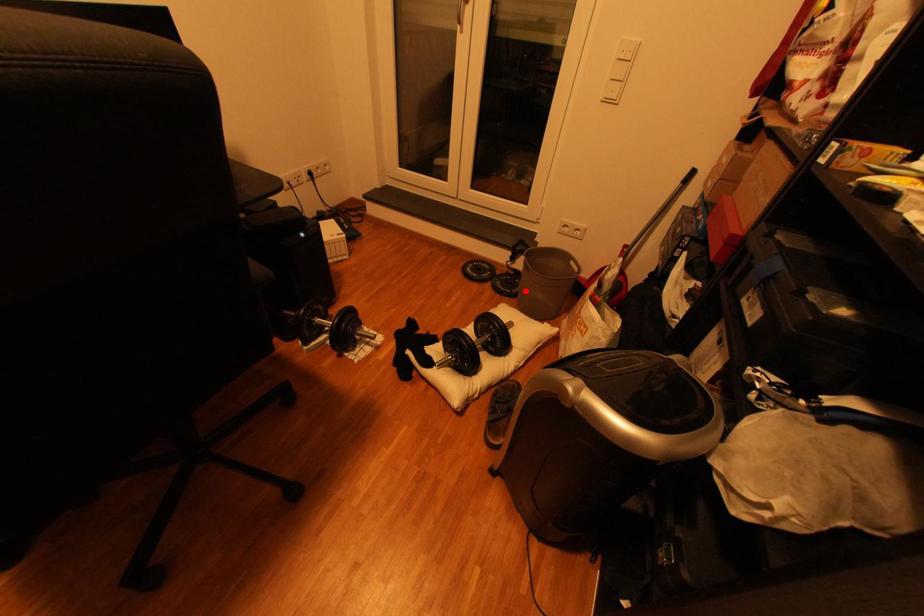
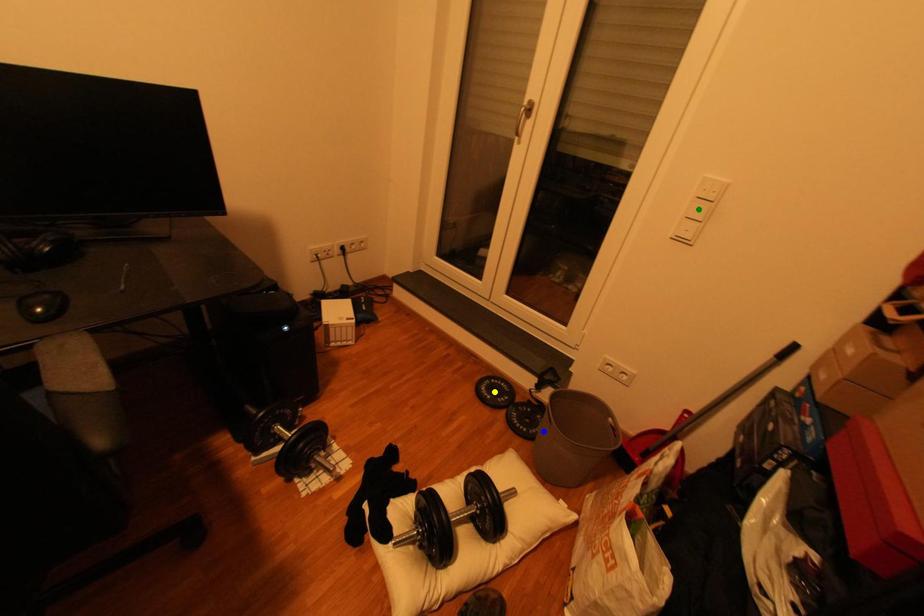
Question: I am providing you with two images of the same scene from different viewpoints. A red point is marked on the first image. You are given multiple points on the second image. Which spot in image 2 lines up with the point in image 1?

Choices:
 (A) green point
 (B) yellow point
 (C) blue point

Answer: (C)